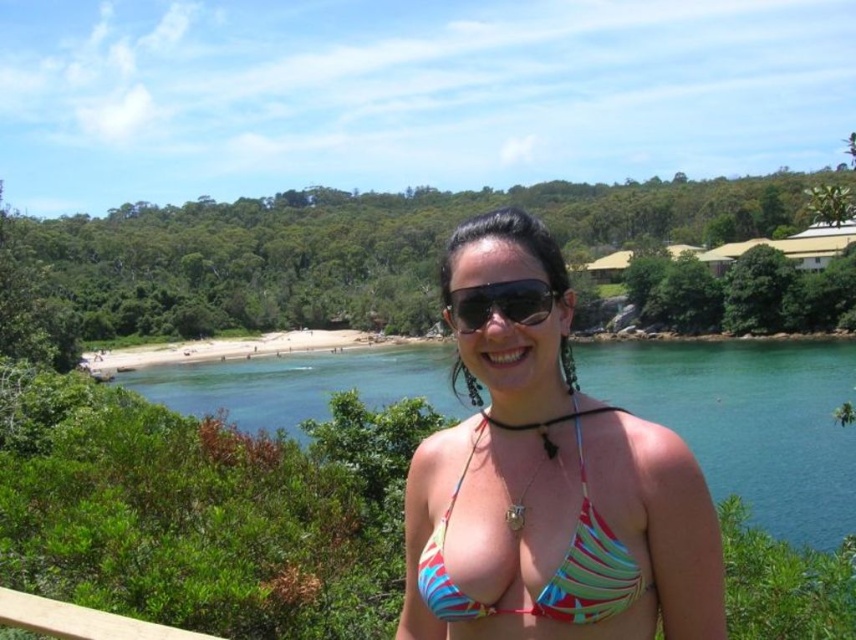
Which is more to the left, blue water at center or black plastic sunglasses at center?

From the viewer's perspective, blue water at center appears more on the left side.

The width and height of the screenshot is (856, 640). What do you see at coordinates (749, 420) in the screenshot? I see `blue water at center` at bounding box center [749, 420].

Where is `blue water at center`? The width and height of the screenshot is (856, 640). blue water at center is located at coordinates (749, 420).

Is point (566, 419) closer to camera compared to point (343, 362)?

That is True.

Describe the element at coordinates (550, 484) in the screenshot. I see `multicolored fabric bikini at center` at that location.

In order to click on multicolored fabric bikini at center in this screenshot , I will do `click(550, 484)`.

Where is `multicolored fabric bikini top at center`? Image resolution: width=856 pixels, height=640 pixels. multicolored fabric bikini top at center is located at coordinates (556, 566).

Is point (462, 604) positioned behind point (539, 280)?

No.

This screenshot has width=856, height=640. What are the coordinates of `multicolored fabric bikini top at center` in the screenshot? It's located at (556, 566).